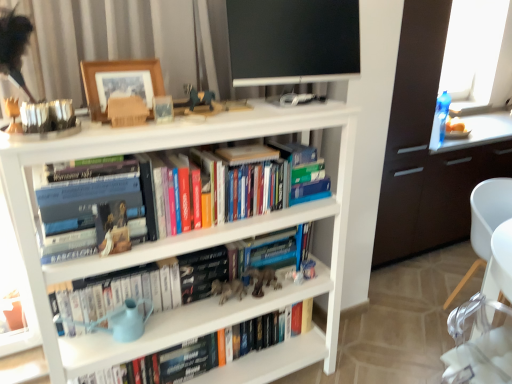
Question: Is hardcover books at center directly adjacent to black glossy flat-screen tv at upper center?

Choices:
 (A) no
 (B) yes

Answer: (A)

Question: Does hardcover books at center lie behind black glossy flat-screen tv at upper center?

Choices:
 (A) no
 (B) yes

Answer: (A)

Question: From the image's perspective, is hardcover books at center above black glossy flat-screen tv at upper center?

Choices:
 (A) yes
 (B) no

Answer: (B)

Question: Considering the relative positions of hardcover books at center and black glossy flat-screen tv at upper center in the image provided, is hardcover books at center to the right of black glossy flat-screen tv at upper center from the viewer's perspective?

Choices:
 (A) no
 (B) yes

Answer: (A)

Question: Is hardcover books at center bigger than black glossy flat-screen tv at upper center?

Choices:
 (A) no
 (B) yes

Answer: (B)

Question: From a real-world perspective, is transparent glass window at upper right above or below black glossy flat-screen tv at upper center?

Choices:
 (A) above
 (B) below

Answer: (B)

Question: Is point (502, 51) positioned closer to the camera than point (239, 28)?

Choices:
 (A) closer
 (B) farther

Answer: (B)

Question: Which is correct: transparent glass window at upper right is inside black glossy flat-screen tv at upper center, or outside of it?

Choices:
 (A) outside
 (B) inside

Answer: (A)

Question: Is transparent glass window at upper right taller or shorter than black glossy flat-screen tv at upper center?

Choices:
 (A) tall
 (B) short

Answer: (A)

Question: Do you think white plastic chair at lower right is within wooden picture frame at upper center, or outside of it?

Choices:
 (A) outside
 (B) inside

Answer: (A)

Question: Based on their sizes in the image, would you say white plastic chair at lower right is bigger or smaller than wooden picture frame at upper center?

Choices:
 (A) small
 (B) big

Answer: (B)

Question: In the image, is white plastic chair at lower right positioned in front of or behind wooden picture frame at upper center?

Choices:
 (A) behind
 (B) front

Answer: (A)

Question: From their relative heights in the image, would you say white plastic chair at lower right is taller or shorter than wooden picture frame at upper center?

Choices:
 (A) short
 (B) tall

Answer: (B)

Question: Which is correct: black glossy flat-screen tv at upper center is inside wooden picture frame at upper center, or outside of it?

Choices:
 (A) inside
 (B) outside

Answer: (B)

Question: From a real-world perspective, is black glossy flat-screen tv at upper center physically located above or below wooden picture frame at upper center?

Choices:
 (A) below
 (B) above

Answer: (B)